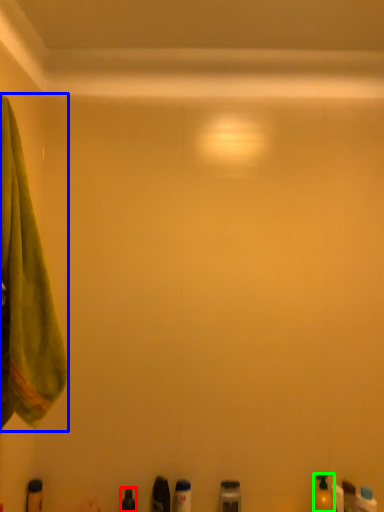
Question: Considering the real-world distances, which object is farthest from toiletry (highlighted by a red box)? towel (highlighted by a blue box) or toiletry (highlighted by a green box)?

Choices:
 (A) towel
 (B) toiletry

Answer: (A)